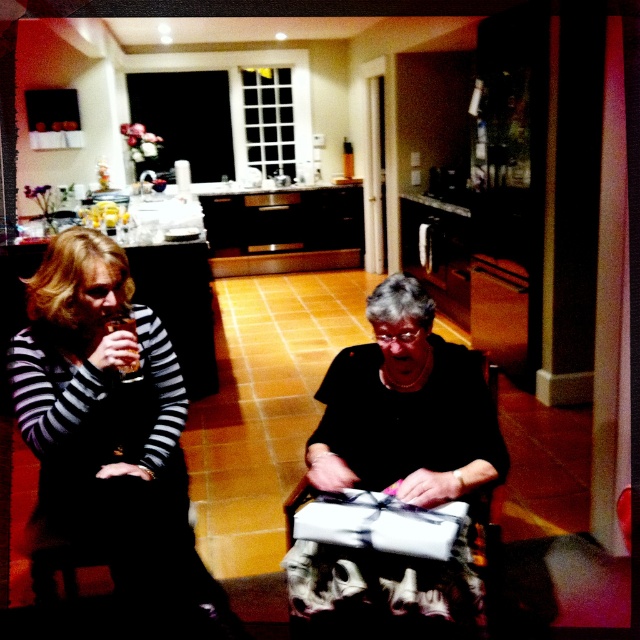
Question: Is striped fabric dress at left to the right of black matte gift at center from the viewer's perspective?

Choices:
 (A) no
 (B) yes

Answer: (A)

Question: Among these objects, which one is nearest to the camera?

Choices:
 (A) striped fabric dress at left
 (B) black matte gift at center

Answer: (B)

Question: Among these objects, which one is farthest from the camera?

Choices:
 (A) striped fabric dress at left
 (B) black matte gift at center

Answer: (A)

Question: Among these points, which one is nearest to the camera?

Choices:
 (A) (120, 465)
 (B) (396, 305)

Answer: (B)

Question: Where is striped fabric dress at left located in relation to black matte gift at center in the image?

Choices:
 (A) left
 (B) right

Answer: (A)

Question: Is the position of striped fabric dress at left less distant than that of black matte gift at center?

Choices:
 (A) no
 (B) yes

Answer: (A)